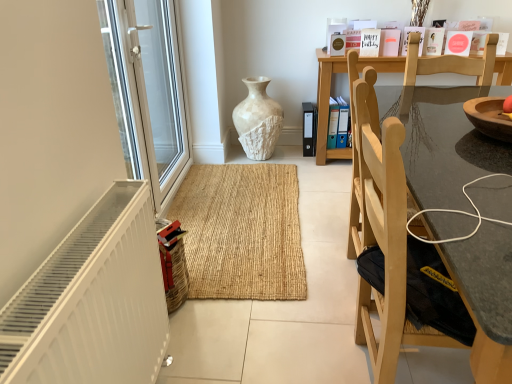
The width and height of the screenshot is (512, 384). What do you see at coordinates (148, 92) in the screenshot?
I see `white glossy screen door at left` at bounding box center [148, 92].

You are a GUI agent. You are given a task and a screenshot of the screen. Output one action in this format:
    pyautogui.click(x=<x>, y=<y>)
    Task: Click on the white textured vase at center
    This screenshot has height=384, width=512.
    Given the screenshot: What is the action you would take?
    pyautogui.click(x=258, y=120)

Can you confirm if light wood chair at right is positioned to the right of white glossy screen door at left?

Correct, you'll find light wood chair at right to the right of white glossy screen door at left.

In the image, is light wood chair at right positioned in front of or behind white glossy screen door at left?

light wood chair at right is positioned closer to the viewer than white glossy screen door at left.

Is there a large distance between light wood chair at right and white glossy screen door at left?

That's right, there is a large distance between light wood chair at right and white glossy screen door at left.

Locate an element on the screen. The width and height of the screenshot is (512, 384). screen door above the light wood chair at right (from a real-world perspective) is located at coordinates pyautogui.click(x=148, y=92).

This screenshot has width=512, height=384. I want to click on screen door that appears above the white textured vase at center (from a real-world perspective), so click(148, 92).

Considering the sizes of objects white textured vase at center and white glossy screen door at left in the image provided, who is shorter, white textured vase at center or white glossy screen door at left?

With less height is white textured vase at center.

Does white textured vase at center touch white glossy screen door at left?

No.

Looking at this image, how different are the orientations of light wood chair at right and white textured vase at center in degrees?

The angle between the facing direction of light wood chair at right and the facing direction of white textured vase at center is 1.18 degrees.

Looking at this image, from the image's perspective, is light wood chair at right located beneath white textured vase at center?

Correct, light wood chair at right appears lower than white textured vase at center in the image.

Between light wood chair at right and white textured vase at center, which one appears on the right side from the viewer's perspective?

Positioned to the right is light wood chair at right.

Do you think light wood chair at right is within white textured vase at center, or outside of it?

light wood chair at right lies outside white textured vase at center.

Locate an element on the screen. chair lying below the white glossy screen door at left (from the image's perspective) is located at coordinates click(x=399, y=212).

In the scene shown: Can you confirm if white glossy screen door at left is bigger than light wood chair at right?

No, white glossy screen door at left is not bigger than light wood chair at right.

Is light wood chair at right completely or partially inside white glossy screen door at left?

No, light wood chair at right is not a part of white glossy screen door at left.

Is white glossy screen door at left beside light wood chair at right?

No, white glossy screen door at left is not touching light wood chair at right.

Where is `vase that is under the white glossy screen door at left (from a real-world perspective)`? The height and width of the screenshot is (384, 512). vase that is under the white glossy screen door at left (from a real-world perspective) is located at coordinates (258, 120).

Is white textured vase at center surrounded by white glossy screen door at left?

No, white textured vase at center is not a part of white glossy screen door at left.

Relative to white textured vase at center, is white glossy screen door at left in front or behind?

white glossy screen door at left is positioned closer to the viewer than white textured vase at center.

The width and height of the screenshot is (512, 384). I want to click on vase below the white matte radiator at lower left (from a real-world perspective), so click(258, 120).

From the picture: Is white textured vase at center positioned behind white matte radiator at lower left?

Yes, white textured vase at center is further from the viewer.

From the image's perspective, is white textured vase at center under white matte radiator at lower left?

No.

Can you confirm if white textured vase at center is wider than white matte radiator at lower left?

Yes, white textured vase at center is wider than white matte radiator at lower left.

Is white matte radiator at lower left bigger or smaller than white textured vase at center?

Clearly, white matte radiator at lower left is smaller in size than white textured vase at center.

You are a GUI agent. You are given a task and a screenshot of the screen. Output one action in this format:
    pyautogui.click(x=<x>, y=<y>)
    Task: Click on the radiator above the white textured vase at center (from a real-world perspective)
    The image size is (512, 384).
    Given the screenshot: What is the action you would take?
    pyautogui.click(x=92, y=301)

From a real-world perspective, between white matte radiator at lower left and white textured vase at center, who is vertically lower?

In real-world perspective, white textured vase at center is lower.

From the image's perspective, would you say white matte radiator at lower left is shown under white textured vase at center?

Correct, white matte radiator at lower left appears lower than white textured vase at center in the image.

At what (x,y) coordinates should I click in order to perform the action: click on chair on the right side of white glossy screen door at left. Please return your answer as a coordinate pair (x, y). Looking at the image, I should click on (399, 212).

At what (x,y) coordinates should I click in order to perform the action: click on screen door on the left of white textured vase at center. Please return your answer as a coordinate pair (x, y). The height and width of the screenshot is (384, 512). Looking at the image, I should click on (148, 92).

Based on their spatial positions, is white matte radiator at lower left or white glossy screen door at left closer to light wood chair at right?

Among the two, white matte radiator at lower left is located nearer to light wood chair at right.

From the image, which object appears to be farther from light wood chair at right, white glossy screen door at left or white matte radiator at lower left?

white glossy screen door at left.

When comparing their distances from white glossy screen door at left, does light wood chair at right or white matte radiator at lower left seem closer?

Based on the image, white matte radiator at lower left appears to be nearer to white glossy screen door at left.

Which object lies further to the anchor point light wood chair at right, white textured vase at center or white matte radiator at lower left?

The object further to light wood chair at right is white textured vase at center.

From the image, which object appears to be farther from white textured vase at center, white glossy screen door at left or white matte radiator at lower left?

Based on the image, white matte radiator at lower left appears to be further to white textured vase at center.

Based on their spatial positions, is light wood chair at right or white glossy screen door at left further from white textured vase at center?

light wood chair at right is positioned further to the anchor white textured vase at center.

From the image, which object appears to be farther from white matte radiator at lower left, white glossy screen door at left or light wood chair at right?

Based on the image, white glossy screen door at left appears to be further to white matte radiator at lower left.

Considering their positions, is white textured vase at center positioned further to white glossy screen door at left than light wood chair at right?

light wood chair at right.

The height and width of the screenshot is (384, 512). Find the location of `radiator between light wood chair at right and white glossy screen door at left from front to back`. radiator between light wood chair at right and white glossy screen door at left from front to back is located at coordinates (92, 301).

You are a GUI agent. You are given a task and a screenshot of the screen. Output one action in this format:
    pyautogui.click(x=<x>, y=<y>)
    Task: Click on the radiator positioned between light wood chair at right and white textured vase at center from near to far
    This screenshot has height=384, width=512.
    Given the screenshot: What is the action you would take?
    pyautogui.click(x=92, y=301)

Identify the location of screen door between light wood chair at right and white textured vase at center in the front-back direction. The width and height of the screenshot is (512, 384). (148, 92).

I want to click on screen door positioned between white matte radiator at lower left and white textured vase at center from near to far, so click(148, 92).